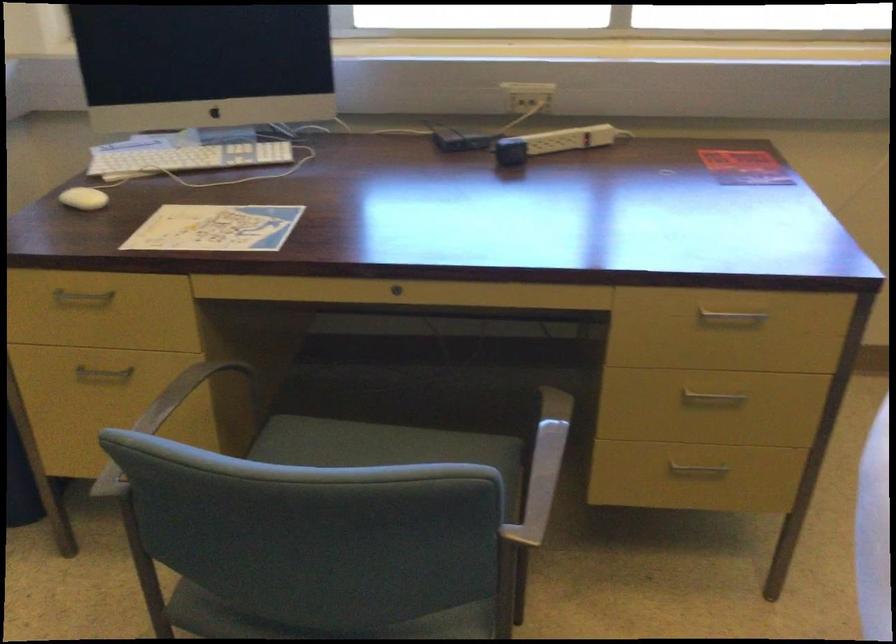
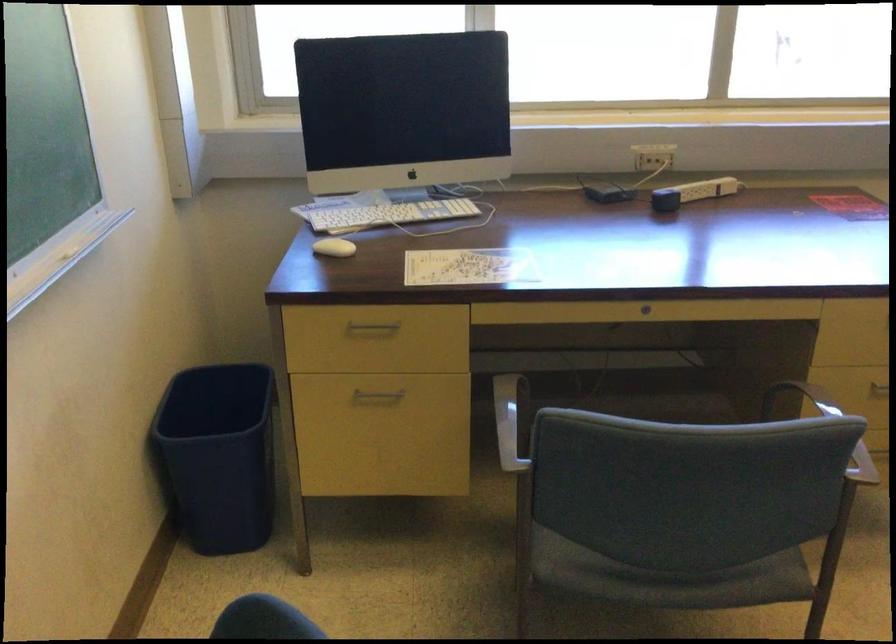
The point at (398, 295) is marked in the first image. Where is the corresponding point in the second image?

(645, 308)